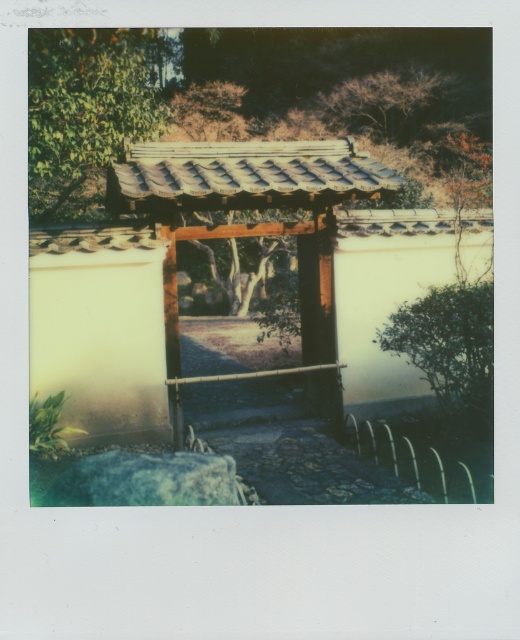
Question: Which of the following is the closest to the observer?

Choices:
 (A) green leafy tree at upper left
 (B) green leafy tree at right
 (C) brown textured tree at upper center

Answer: (B)

Question: Considering the relative positions of wooden gate at center and green leafy tree at right in the image provided, where is wooden gate at center located with respect to green leafy tree at right?

Choices:
 (A) below
 (B) above

Answer: (B)

Question: Which is farther from the wooden gate at center?

Choices:
 (A) brown textured tree at upper center
 (B) green leafy tree at upper left

Answer: (A)

Question: Among these objects, which one is nearest to the camera?

Choices:
 (A) brown textured tree at upper center
 (B) green leafy tree at upper left
 (C) green leafy tree at right

Answer: (C)

Question: Does green leafy tree at upper left have a smaller size compared to brown textured tree at upper center?

Choices:
 (A) yes
 (B) no

Answer: (B)

Question: Is green leafy tree at right closer to camera compared to brown textured tree at upper center?

Choices:
 (A) no
 (B) yes

Answer: (B)